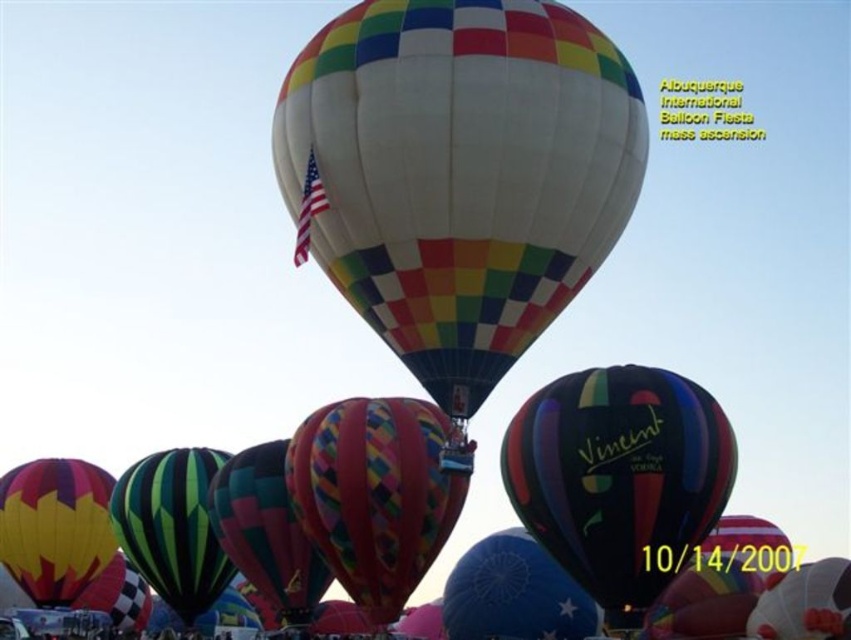
Question: Which object appears closest to the camera in this image?

Choices:
 (A) multicolored glossy balloon at center
 (B) rainbow checkered fabric hot air balloon at center
 (C) multicolored fabric balloon at center
 (D) yellow and red striped fabric hot air balloon at left

Answer: (B)

Question: Can you confirm if rainbow checkered fabric hot air balloon at center is bigger than multicolored fabric balloon at center?

Choices:
 (A) yes
 (B) no

Answer: (B)

Question: Which of the following is the farthest from the observer?

Choices:
 (A) yellow and red striped fabric hot air balloon at left
 (B) multicolored fabric balloon at center
 (C) rainbow checkered fabric hot air balloon at center
 (D) multicolored glossy balloon at center

Answer: (A)

Question: Which of the following is the farthest from the observer?

Choices:
 (A) (604, 420)
 (B) (312, 522)
 (C) (386, 163)
 (D) (43, 552)

Answer: (D)

Question: Does multicolored glossy balloon at center lie in front of multicolored fabric balloon at center?

Choices:
 (A) yes
 (B) no

Answer: (B)

Question: Does multicolored glossy balloon at center appear under yellow and red striped fabric hot air balloon at left?

Choices:
 (A) no
 (B) yes

Answer: (A)